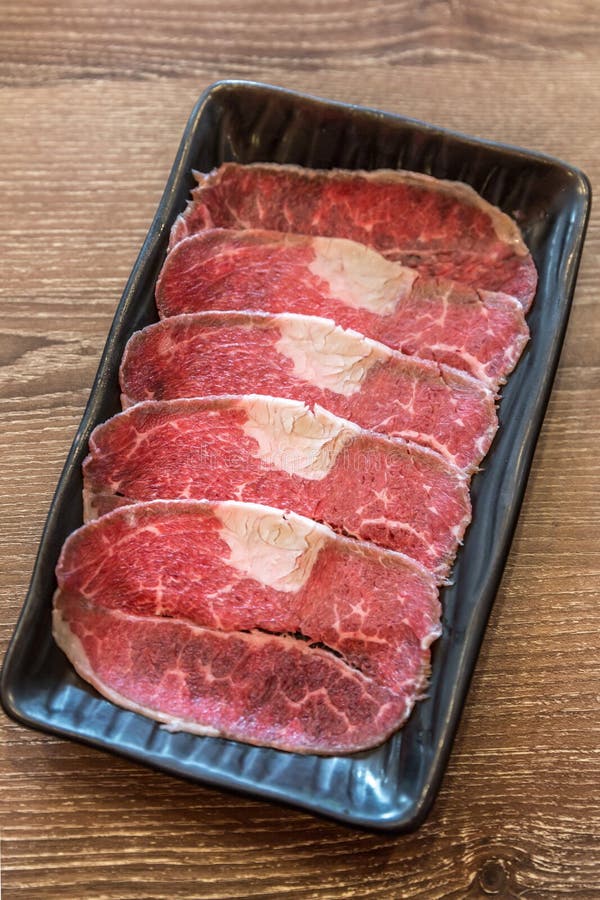
The height and width of the screenshot is (900, 600). Identify the location of table. (61, 822).